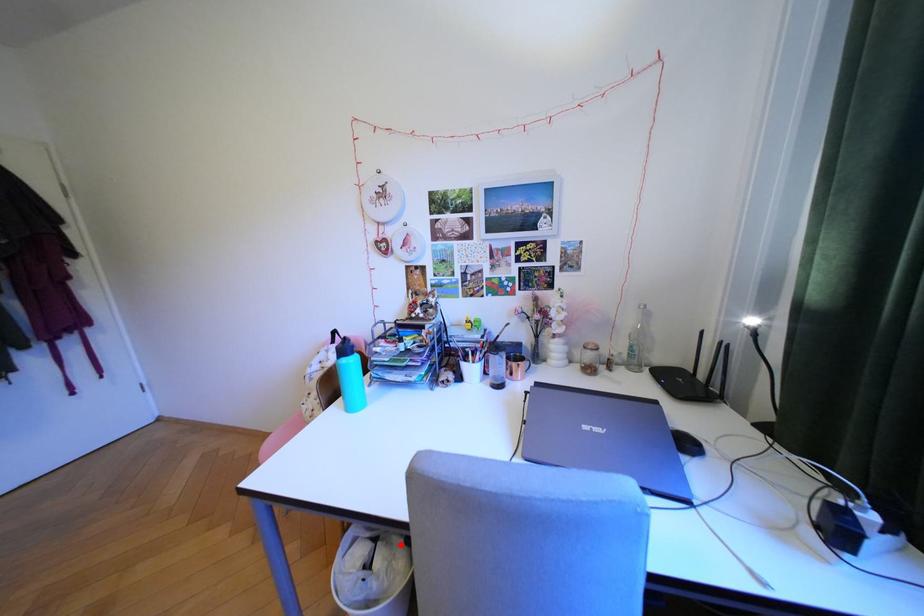
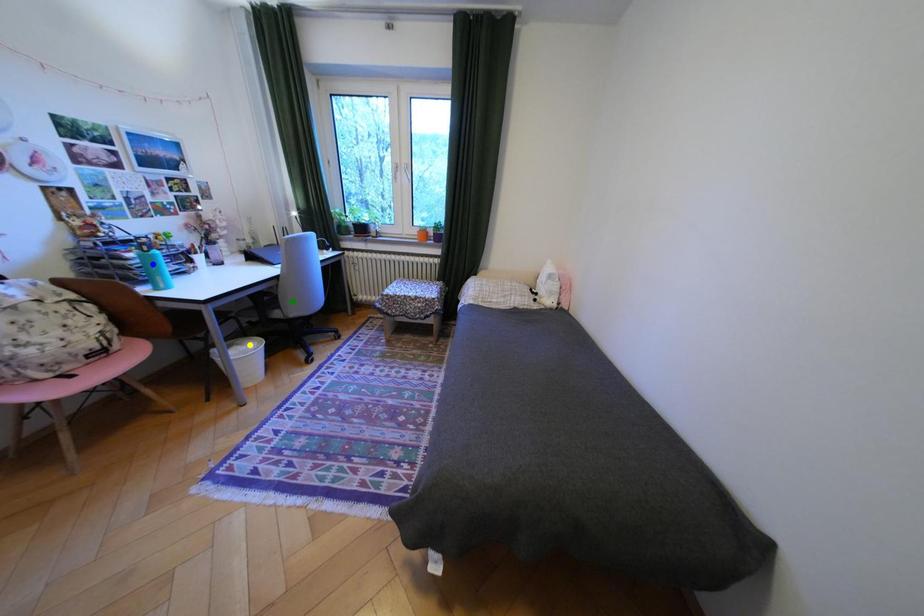
Question: I am providing you with two images of the same scene from different viewpoints. A red point is marked on the first image. You are given multiple points on the second image. Which point in image 2 is actually the same real-world point as the red point in image 1?

Choices:
 (A) green point
 (B) yellow point
 (C) blue point

Answer: (B)